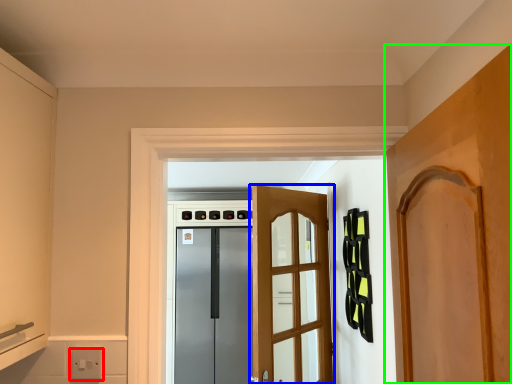
Question: Which is nearer to the electric outlet (highlighted by a red box)? door (highlighted by a blue box) or door (highlighted by a green box).

Choices:
 (A) door
 (B) door

Answer: (B)